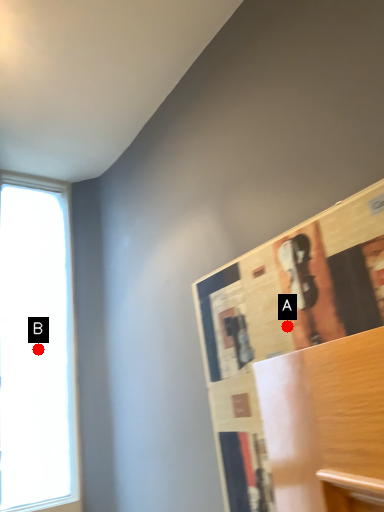
Question: Two points are circled on the image, labeled by A and B beside each circle. Which point appears farthest from the camera in this image?

Choices:
 (A) A is further
 (B) B is further

Answer: (B)